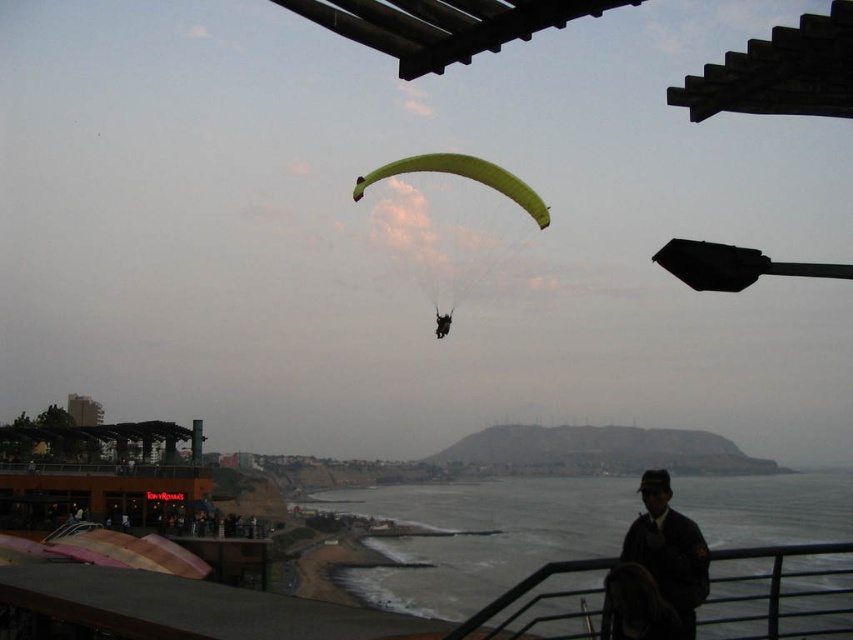
Question: Does dark brown leather jacket at lower right lie behind green fabric parachute at center?

Choices:
 (A) yes
 (B) no

Answer: (B)

Question: Does clear water at lower center appear on the left side of green fabric parachute at center?

Choices:
 (A) yes
 (B) no

Answer: (B)

Question: Which of the following is the farthest from the observer?

Choices:
 (A) (657, 547)
 (B) (393, 164)
 (C) (769, 536)

Answer: (C)

Question: Can you confirm if clear water at lower center is bigger than green fabric parachute at center?

Choices:
 (A) no
 (B) yes

Answer: (A)

Question: Which object is closer to the camera taking this photo?

Choices:
 (A) clear water at lower center
 (B) green fabric parachute at center

Answer: (B)

Question: Which point is farther to the camera?

Choices:
 (A) dark brown leather jacket at lower right
 (B) green fabric parachute at center
 (C) clear water at lower center

Answer: (C)